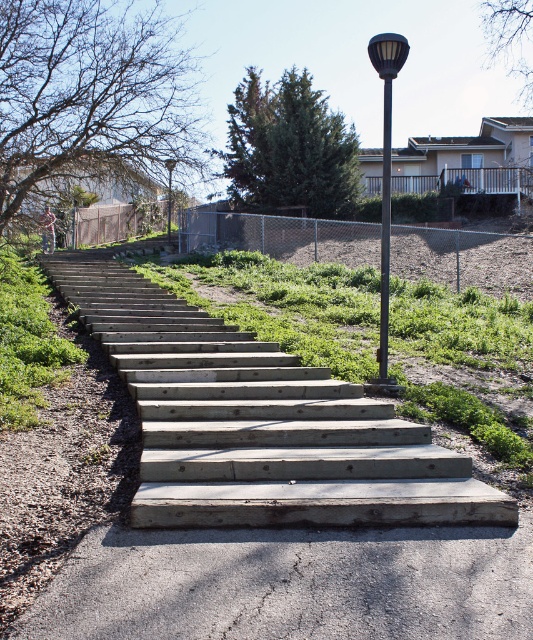
You are a painter who needs to paint both the wooden stairs at center and the metallic pole at center. If you have enough paint for only one of them, which object should you choose to paint based on their sizes?

The wooden stairs at center is smaller than the metallic pole at center, so you should paint the wooden stairs at center first since it requires less paint.

You are standing at the bottom of the wooden stairs at center and want to place a small potted plant exactly at the point marked as point (259,422). Since you can only move straight up the stairs, will you be able to reach that point without deviating from your path?

The point (259,422) is on the wooden stairs at center, so yes, you can reach it by moving straight up the stairs as it lies along the path of the stairs.

You are a delivery person carrying a large box that is 2 meters wide. You need to navigate from the gray concrete pavement at lower center to the wooden stairs at center. Can your box fit through the space between the two structures?

The wooden stairs at center are wider than the gray concrete pavement at lower center. Since the box is 2 meters wide, it may not fit through the narrower gray concrete pavement at lower center, but the wider wooden stairs at center might accommodate it. However, the exact width of the stairs isn not specified, so it depends on whether the stairs are at least 2 meters wide.